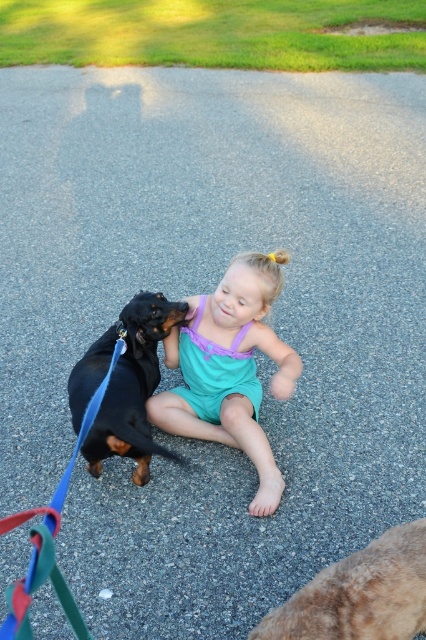
You are a photographer trying to capture the perfect shot of the child and the dog. You want to focus on the matte teal swimsuit at center. Where exactly should you aim your camera to ensure the swimsuit is in the center of the photo?

You should aim your camera at the coordinates point (230, 369) to ensure the matte teal swimsuit at center is captured in the center of the photo.

You are standing at the point with coordinates point (x=253, y=515) and want to walk to the point with coordinates point (x=419, y=552). Which direction should you move in to reach your destination?

To reach point (x=419, y=552) from point (x=253, y=515), you should move upwards because point (x=253, y=515) is behind point (x=419, y=552).